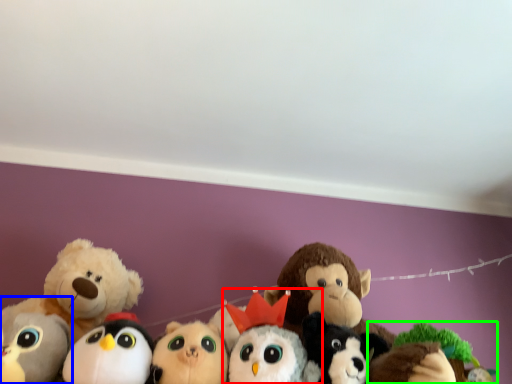
Question: Considering the real-world distances, which object is farthest from toy (highlighted by a red box)? toy (highlighted by a blue box) or toy (highlighted by a green box)?

Choices:
 (A) toy
 (B) toy

Answer: (A)